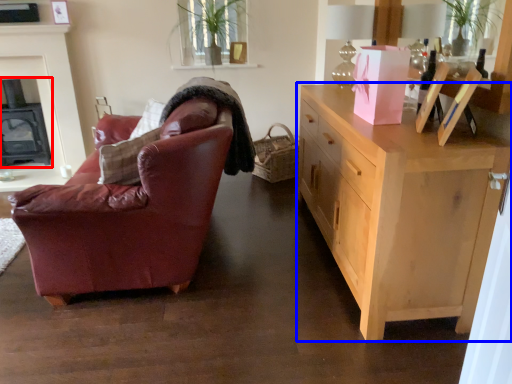
Question: Which of the following is the farthest to the observer, fireplace (highlighted by a red box) or cabinetry (highlighted by a blue box)?

Choices:
 (A) fireplace
 (B) cabinetry

Answer: (A)